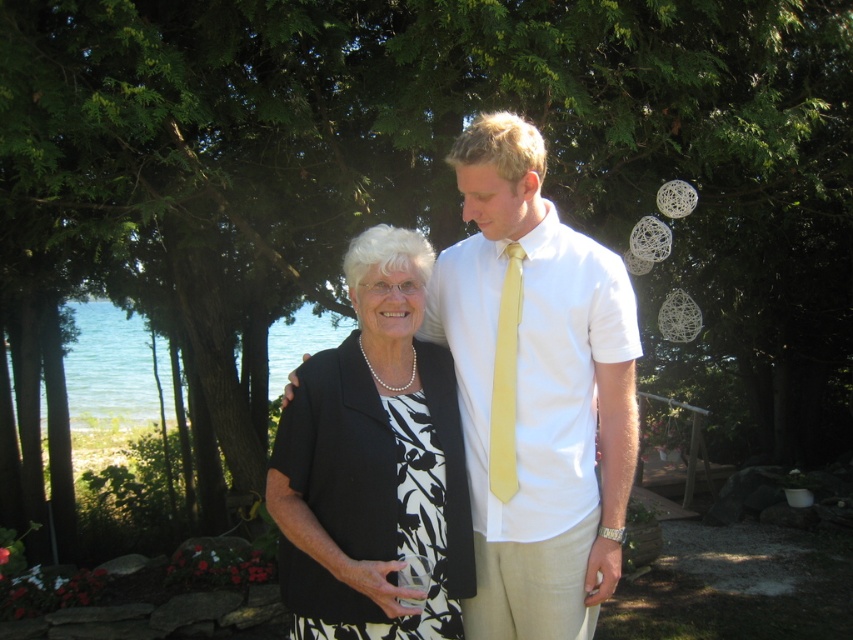
You are a photographer at the event and need to capture a photo of both the white cotton shirt at center and the yellow satin tie at center. Which one should you focus on first if you want to ensure both are in the frame?

You should focus on the yellow satin tie at center first because the white cotton shirt at center is to the right of it, so adjusting the frame to include both would require expanding to the right from the tie.

You are a photographer at a family event and need to ensure both the white cotton shirt at center and the yellow satin tie at center are visible in the photo. Given their positions, which one might appear larger in the final image?

The white cotton shirt at center appears larger in the photo because it is taller than the yellow satin tie at center.